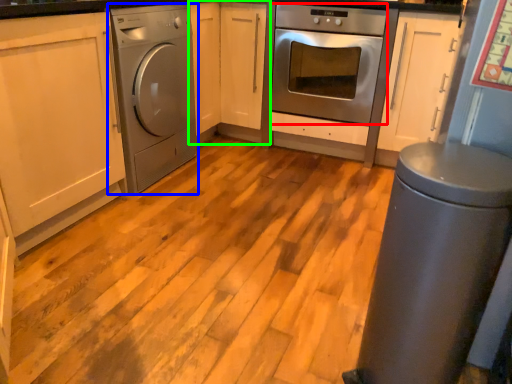
Question: Considering the real-world distances, which object is farthest from oven (highlighted by a red box)? home appliance (highlighted by a blue box) or cabinetry (highlighted by a green box)?

Choices:
 (A) home appliance
 (B) cabinetry

Answer: (A)